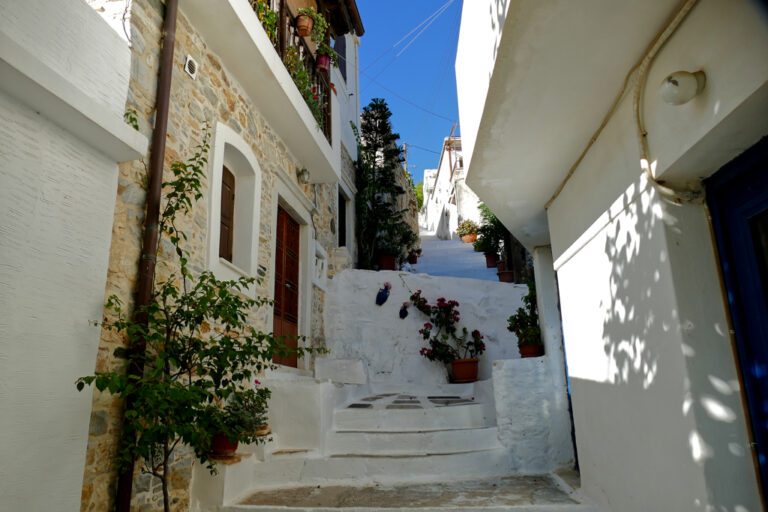
The height and width of the screenshot is (512, 768). Identify the location of window. (230, 245).